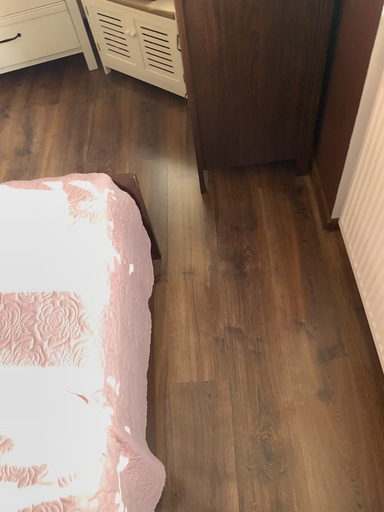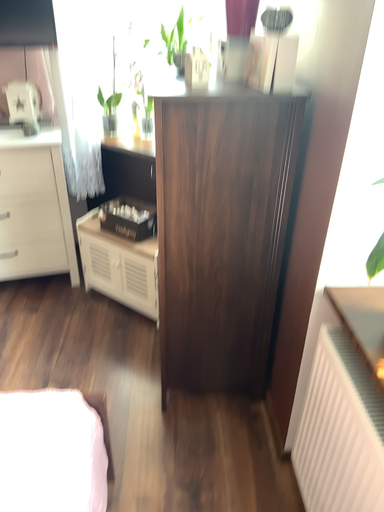
Question: How did the camera likely rotate when shooting the video?

Choices:
 (A) rotated left
 (B) rotated right

Answer: (B)